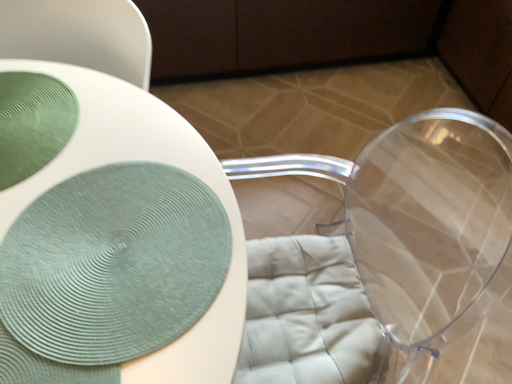
Question: Choose the correct answer: Is green textured placemat at center inside green textured plate at upper left or outside it?

Choices:
 (A) inside
 (B) outside

Answer: (B)

Question: Relative to green textured plate at upper left, is green textured placemat at center in front or behind?

Choices:
 (A) front
 (B) behind

Answer: (A)

Question: From the image's perspective, is green textured placemat at center positioned above or below green textured plate at upper left?

Choices:
 (A) above
 (B) below

Answer: (B)

Question: From a real-world perspective, is green textured plate at upper left above or below green textured placemat at center?

Choices:
 (A) above
 (B) below

Answer: (A)

Question: Considering their positions, is green textured plate at upper left located in front of or behind green textured placemat at center?

Choices:
 (A) front
 (B) behind

Answer: (B)

Question: From the image's perspective, relative to green textured placemat at center, is green textured plate at upper left above or below?

Choices:
 (A) below
 (B) above

Answer: (B)

Question: Is green textured plate at upper left to the left or to the right of green textured placemat at center in the image?

Choices:
 (A) right
 (B) left

Answer: (B)